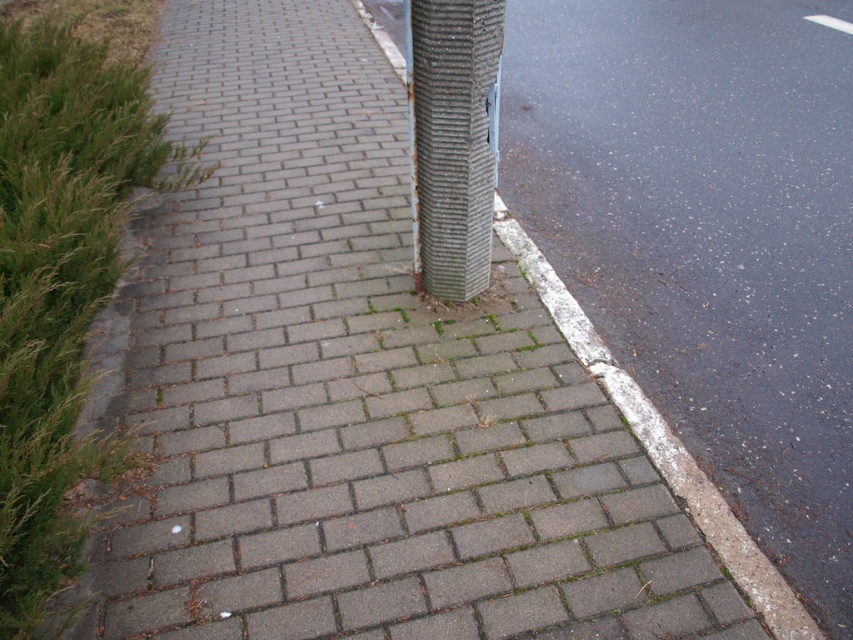
Question: Does rough textured pole at center have a lesser width compared to white concrete curb at lower right?

Choices:
 (A) no
 (B) yes

Answer: (B)

Question: Which point appears farthest from the camera in this image?

Choices:
 (A) (476, 161)
 (B) (544, 262)

Answer: (B)

Question: Which point is closer to the camera taking this photo?

Choices:
 (A) (538, 257)
 (B) (453, 266)

Answer: (B)

Question: Is rough textured pole at center bigger than white concrete curb at lower right?

Choices:
 (A) yes
 (B) no

Answer: (B)

Question: Is rough textured pole at center to the left of white concrete curb at lower right from the viewer's perspective?

Choices:
 (A) yes
 (B) no

Answer: (A)